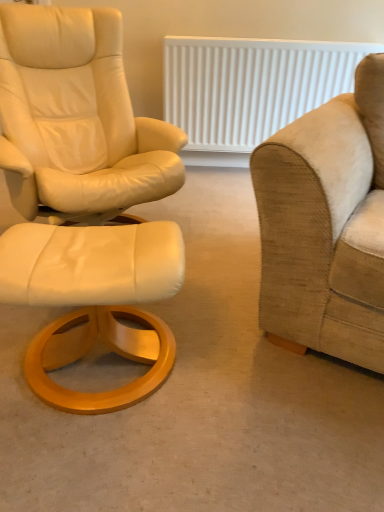
Question: Should I look upward or downward to see white leather ottoman at left?

Choices:
 (A) up
 (B) down

Answer: (B)

Question: Could you tell me if white textured radiator at upper center is turned towards white leather ottoman at left?

Choices:
 (A) no
 (B) yes

Answer: (B)

Question: Is white textured radiator at upper center at the right side of white leather ottoman at left?

Choices:
 (A) yes
 (B) no

Answer: (A)

Question: Considering the relative positions of white textured radiator at upper center and white leather ottoman at left in the image provided, is white textured radiator at upper center behind white leather ottoman at left?

Choices:
 (A) yes
 (B) no

Answer: (A)

Question: From a real-world perspective, does white textured radiator at upper center stand above white leather ottoman at left?

Choices:
 (A) no
 (B) yes

Answer: (B)

Question: Can you confirm if white textured radiator at upper center is smaller than white leather ottoman at left?

Choices:
 (A) no
 (B) yes

Answer: (A)

Question: From the image's perspective, would you say white textured radiator at upper center is shown under white leather ottoman at left?

Choices:
 (A) no
 (B) yes

Answer: (A)

Question: Would you say matte white ottoman at left is a long distance from beige fabric couch at right?

Choices:
 (A) no
 (B) yes

Answer: (A)

Question: Does matte white ottoman at left lie behind beige fabric couch at right?

Choices:
 (A) no
 (B) yes

Answer: (B)

Question: Considering the relative positions of matte white ottoman at left and beige fabric couch at right in the image provided, is matte white ottoman at left to the left of beige fabric couch at right from the viewer's perspective?

Choices:
 (A) yes
 (B) no

Answer: (A)

Question: Is matte white ottoman at left next to beige fabric couch at right and touching it?

Choices:
 (A) yes
 (B) no

Answer: (B)

Question: Can beige fabric couch at right be found inside matte white ottoman at left?

Choices:
 (A) no
 (B) yes

Answer: (A)

Question: Does matte white ottoman at left have a lesser height compared to beige fabric couch at right?

Choices:
 (A) yes
 (B) no

Answer: (A)

Question: Is matte white ottoman at left taller than white leather ottoman at left?

Choices:
 (A) yes
 (B) no

Answer: (B)